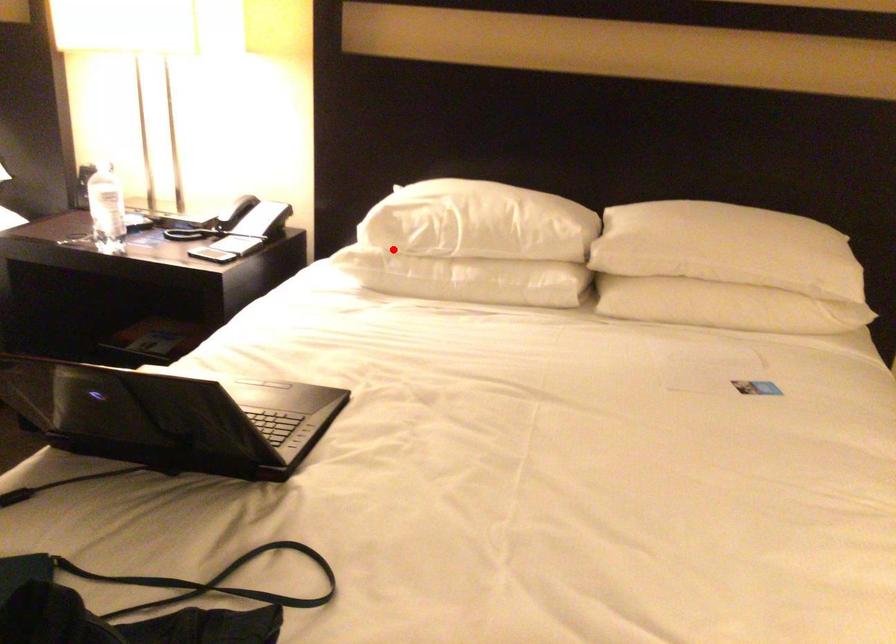
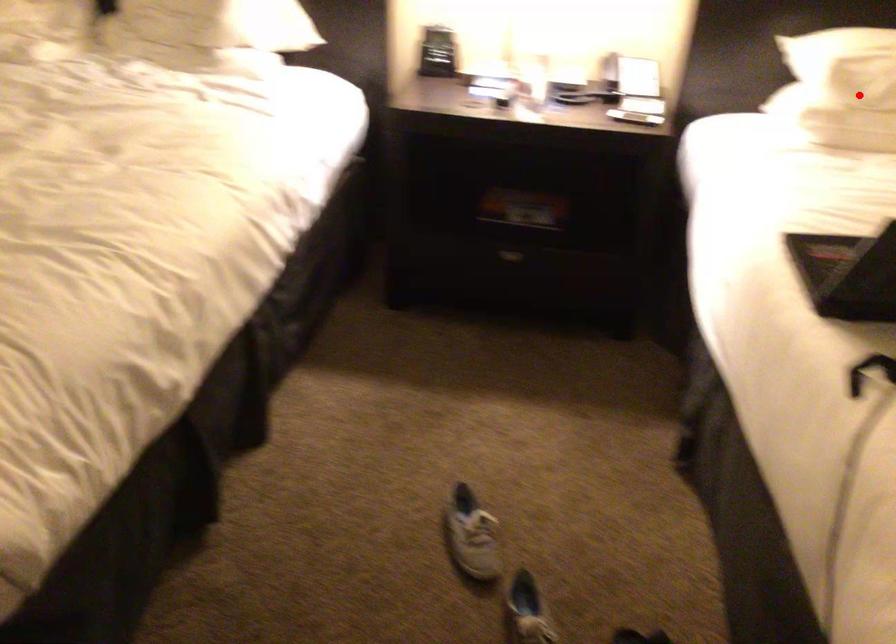
From the picture: I am providing you with two images of the same scene from different viewpoints. A red point is marked on the first image and another point is marked on the second image. Are the points marked in image1 and image2 representing the same 3D position?

Yes